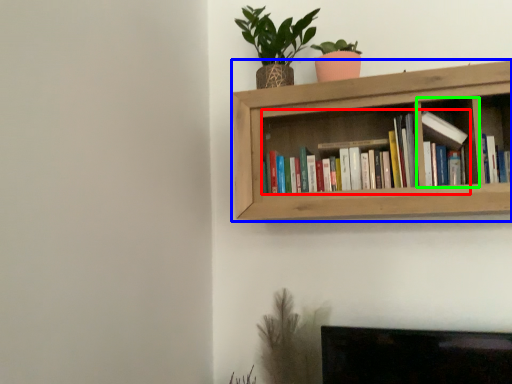
Question: Estimate the real-world distances between objects in this image. Which object is farther from book (highlighted by a red box), shelf (highlighted by a blue box) or cabinet (highlighted by a green box)?

Choices:
 (A) shelf
 (B) cabinet

Answer: (B)